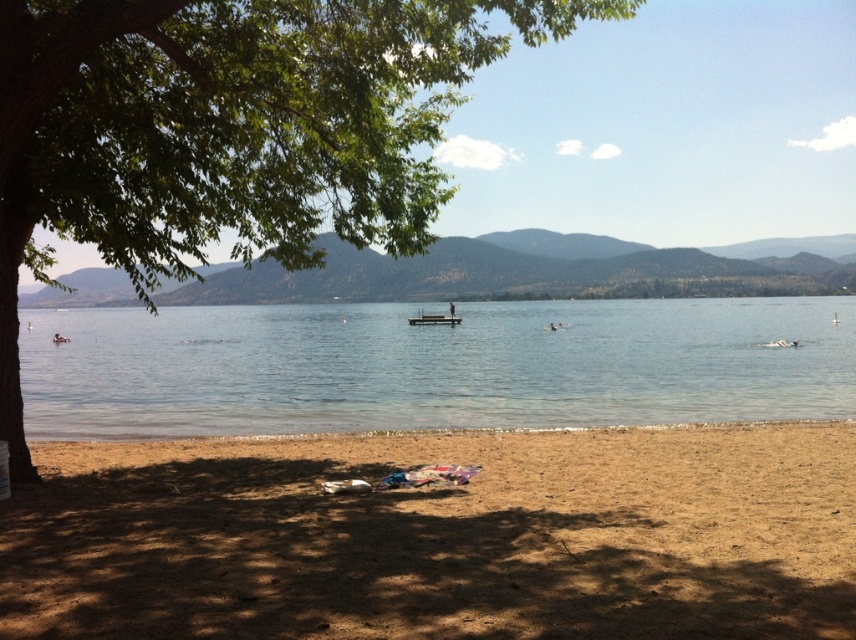
Find the location of a particular element. brown sandy beach at lower center is located at coordinates (440, 536).

Does green leafy tree at lower left have a greater width compared to wooden dock at center?

Indeed, green leafy tree at lower left has a greater width compared to wooden dock at center.

Based on the photo, does green leafy tree at lower left appear on the right side of wooden dock at center?

Answer: In fact, green leafy tree at lower left is to the left of wooden dock at center.

Who is more distant from viewer, [417,76] or [455,316]?

Positioned behind is point [455,316].

Where is `green leafy tree at lower left`? The width and height of the screenshot is (856, 640). green leafy tree at lower left is located at coordinates (230, 131).

Is green leafy tree at lower left thinner than clear blue water at center?

Yes.

Consider the image. How much distance is there between green leafy tree at lower left and clear blue water at center?

The distance of green leafy tree at lower left from clear blue water at center is 26.78 feet.

Who is more forward, (413, 33) or (578, 324)?

Point (413, 33)

Where is `green leafy tree at lower left`? Image resolution: width=856 pixels, height=640 pixels. green leafy tree at lower left is located at coordinates (230, 131).